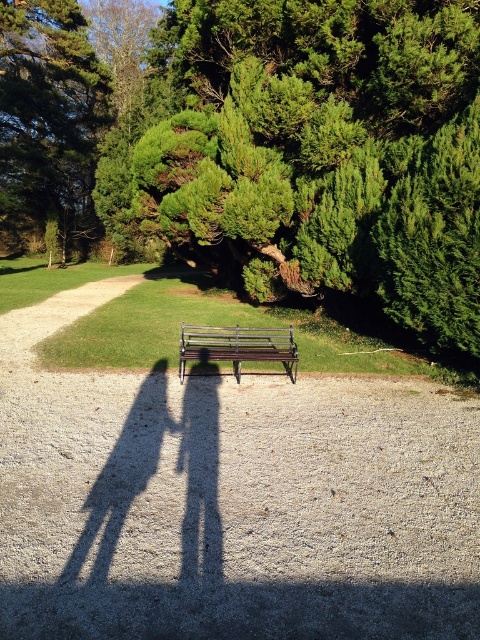
You are standing at the wooden bench on the gravel path and want to take a photo of both point (87, 221) and point (294, 381). Which point should you focus on first to ensure both are in the frame?

You should focus on point (87, 221) first because it is closer to the camera than point (294, 381). This ensures both points are within the frame by starting from the nearest point and adjusting the view to include the farther one.

You are standing at the end of the gravel pathway and want to sit on the wooden bench at center. However, there is a green leafy tree at upper left in your way. Can you walk directly to the bench without going around the tree?

The wooden bench at center is behind the green leafy tree at upper left, so you would need to walk around the tree to reach the bench.

You are standing at the camera position and want to reach the point marked at coordinates (40, 70). If your walking speed is 1.5 meters per second, how many seconds will it take you to reach that point?

The distance between the point marked at coordinates (40, 70) and the camera is 48.60 meters. At a walking speed of 1.5 meters per second, it would take 48.60 divided by 1.5, which equals 32.4 seconds to reach the point.